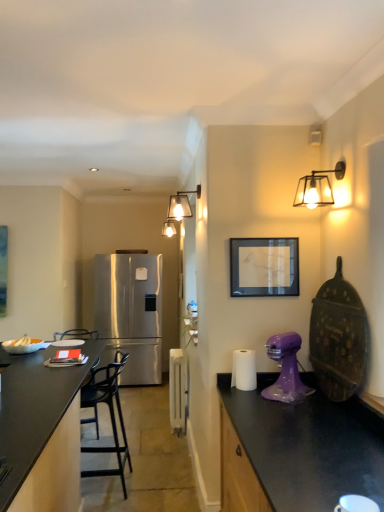
You are a GUI agent. You are given a task and a screenshot of the screen. Output one action in this format:
    pyautogui.click(x=<x>, y=<y>)
    Task: Click on the metallic glass sconce at upper right, which ranks as the second light fixture in back-to-front order
    
    Given the screenshot: What is the action you would take?
    pyautogui.click(x=317, y=187)

The width and height of the screenshot is (384, 512). Describe the element at coordinates (286, 369) in the screenshot. I see `purple plastic mixer at right` at that location.

The width and height of the screenshot is (384, 512). Describe the element at coordinates (109, 411) in the screenshot. I see `black matte chair at center` at that location.

Find the location of `black matte chair at center`. black matte chair at center is located at coordinates (109, 411).

Where is `wooden carved shield at right, marked as the 2th appliance in a back-to-front arrangement`? This screenshot has width=384, height=512. wooden carved shield at right, marked as the 2th appliance in a back-to-front arrangement is located at coordinates (338, 338).

This screenshot has width=384, height=512. Describe the element at coordinates (38, 423) in the screenshot. I see `black matte countertop at left` at that location.

Identify the location of metallic glass sconce at upper right, which ranks as the second light fixture in back-to-front order. This screenshot has width=384, height=512. (317, 187).

Is matte black picture frame at upper center directly adjacent to metallic glass sconce at upper right, which is the first light fixture in front-to-back order?

matte black picture frame at upper center is not next to metallic glass sconce at upper right, which is the first light fixture in front-to-back order, and they're not touching.

Considering the positions of objects matte black picture frame at upper center and metallic glass sconce at upper right, which is the first light fixture in front-to-back order, in the image provided, who is in front, matte black picture frame at upper center or metallic glass sconce at upper right, which is the first light fixture in front-to-back order,?

metallic glass sconce at upper right, which is the first light fixture in front-to-back order, is closer to the camera.

Between matte black picture frame at upper center and metallic glass sconce at upper right, which ranks as the second light fixture in back-to-front order, which one has smaller size?

matte black picture frame at upper center is smaller.

Which point is more forward, (288, 242) or (329, 172)?

The point (329, 172) is in front.

From the image's perspective, is white matte paper towel at right located above or below white glossy radiator at center, which is counted as the 1th appliance, starting from the bottom?

→ Based on their image positions, white matte paper towel at right is located above white glossy radiator at center, which is counted as the 1th appliance, starting from the bottom.

This screenshot has height=512, width=384. Identify the location of paper towel above the white glossy radiator at center, which is counted as the 1th appliance, starting from the bottom (from a real-world perspective). (244, 370).

Which object is thinner, white matte paper towel at right or white glossy radiator at center, which is the second appliance in top-to-bottom order?

white glossy radiator at center, which is the second appliance in top-to-bottom order.

Would you say white matte paper towel at right is outside white glossy radiator at center, placed as the first appliance when sorted from left to right?

Yes, white matte paper towel at right is not within white glossy radiator at center, placed as the first appliance when sorted from left to right.

Can you confirm if white glossy radiator at center, the second appliance in the right-to-left sequence, is thinner than white matte paper towel at right?

Yes.

Is the position of white glossy radiator at center, which is counted as the 1th appliance, starting from the back, less distant than that of white matte paper towel at right?

That is False.

This screenshot has height=512, width=384. I want to click on paper towel that is on the right side of white glossy radiator at center, which is counted as the 1th appliance, starting from the back, so [244, 370].

Considering the sizes of white glossy radiator at center, which is the second appliance in top-to-bottom order, and white matte paper towel at right in the image, is white glossy radiator at center, which is the second appliance in top-to-bottom order, taller or shorter than white matte paper towel at right?

In the image, white glossy radiator at center, which is the second appliance in top-to-bottom order, appears to be taller than white matte paper towel at right.

From the image's perspective, is metallic glass sconce at upper right, the first light fixture from the right, located above or below matte black picture frame at upper center?

metallic glass sconce at upper right, the first light fixture from the right, is situated higher than matte black picture frame at upper center in the image.

From a real-world perspective, is metallic glass sconce at upper right, the first light fixture from the right, positioned above or below matte black picture frame at upper center?

metallic glass sconce at upper right, the first light fixture from the right, is situated higher than matte black picture frame at upper center in the real world.

Considering the relative sizes of metallic glass sconce at upper right, which ranks as the second light fixture in back-to-front order, and matte black picture frame at upper center in the image provided, is metallic glass sconce at upper right, which ranks as the second light fixture in back-to-front order, thinner than matte black picture frame at upper center?

Incorrect, the width of metallic glass sconce at upper right, which ranks as the second light fixture in back-to-front order, is not less than that of matte black picture frame at upper center.

Is metallic glass sconce at upper right, which is the first light fixture in front-to-back order, located outside matte black picture frame at upper center?

That's correct, metallic glass sconce at upper right, which is the first light fixture in front-to-back order, is outside of matte black picture frame at upper center.

Can you confirm if white glossy radiator at center, which is the second appliance in top-to-bottom order, is taller than purple plastic mixer at right?

Correct, white glossy radiator at center, which is the second appliance in top-to-bottom order, is much taller as purple plastic mixer at right.

Is point (181, 430) less distant than point (307, 391)?

No, it is behind (307, 391).

Which of these two, matte glass sconce at upper center, acting as the 2th light fixture starting from the front, or metallic glass sconce at upper right, which is the first light fixture in front-to-back order, is smaller?

matte glass sconce at upper center, acting as the 2th light fixture starting from the front, is smaller.

Based on the photo, from the image's perspective, which is below, matte glass sconce at upper center, the 1th light fixture viewed from the back, or metallic glass sconce at upper right, which ranks as the second light fixture in back-to-front order?

matte glass sconce at upper center, the 1th light fixture viewed from the back, appears lower in the image.

Considering the sizes of objects matte black picture frame at upper center and black matte countertop at left in the image provided, who is smaller, matte black picture frame at upper center or black matte countertop at left?

With smaller size is matte black picture frame at upper center.

Looking at this image, is matte black picture frame at upper center turned away from black matte countertop at left?

That's not correct — matte black picture frame at upper center is not looking away from black matte countertop at left.

Can you confirm if matte black picture frame at upper center is shorter than black matte countertop at left?

Yes, matte black picture frame at upper center is shorter than black matte countertop at left.

This screenshot has height=512, width=384. Identify the location of picture frame that appears behind the metallic glass sconce at upper right, which ranks as the 2th light fixture in left-to-right order. (264, 267).

The width and height of the screenshot is (384, 512). Identify the location of paper towel that is in front of the white glossy radiator at center, arranged as the second appliance when viewed from the front. (244, 370).

Estimate the real-world distances between objects in this image. Which object is closer to black matte chair at center, purple plastic mixer at right or black matte countertop at left?

black matte countertop at left lies closer to black matte chair at center than the other object.

Based on their spatial positions, is matte black picture frame at upper center or black matte chair at center closer to black matte countertop at left?

black matte chair at center.

Which object lies further to the anchor point white matte paper towel at right, white glossy coffee cup at lower right or metallic glass sconce at upper right, which ranks as the second light fixture in back-to-front order?

Among the two, white glossy coffee cup at lower right is located further to white matte paper towel at right.

When comparing their distances from white glossy coffee cup at lower right, does satin stainless steel refrigerator at center or matte glass sconce at upper center, acting as the 2th light fixture starting from the front, seem closer?

matte glass sconce at upper center, acting as the 2th light fixture starting from the front, lies closer to white glossy coffee cup at lower right than the other object.

Based on the photo, when comparing their distances from black matte countertop at left, does wooden carved shield at right, which appears as the first appliance when viewed from the top, or matte black picture frame at upper center seem further?

wooden carved shield at right, which appears as the first appliance when viewed from the top.

Considering their positions, is white glossy coffee cup at lower right positioned further to metallic glass sconce at upper right, which is the first light fixture in front-to-back order, than matte black picture frame at upper center?

white glossy coffee cup at lower right is positioned further to the anchor metallic glass sconce at upper right, which is the first light fixture in front-to-back order.

Estimate the real-world distances between objects in this image. Which object is closer to purple plastic mixer at right, white glossy coffee cup at lower right or white matte paper towel at right?

Among the two, white matte paper towel at right is located nearer to purple plastic mixer at right.

From the image, which object appears to be nearer to matte black picture frame at upper center, metallic glass sconce at upper right, which ranks as the second light fixture in back-to-front order, or satin stainless steel refrigerator at center?

metallic glass sconce at upper right, which ranks as the second light fixture in back-to-front order.

Locate an element on the screen. The width and height of the screenshot is (384, 512). picture frame between matte glass sconce at upper center, which is counted as the 2th light fixture, starting from the right, and black matte chair at center, in the vertical direction is located at coordinates (264, 267).

Identify the location of picture frame located between metallic glass sconce at upper right, which ranks as the 2th light fixture in left-to-right order, and satin stainless steel refrigerator at center in the depth direction. The image size is (384, 512). (264, 267).

Where is `appliance between white glossy coffee cup at lower right and white glossy radiator at center, which is the second appliance in top-to-bottom order, along the z-axis`? appliance between white glossy coffee cup at lower right and white glossy radiator at center, which is the second appliance in top-to-bottom order, along the z-axis is located at coordinates (338, 338).

Where is `chair between black matte countertop at left and matte black picture frame at upper center`? Image resolution: width=384 pixels, height=512 pixels. chair between black matte countertop at left and matte black picture frame at upper center is located at coordinates (109, 411).